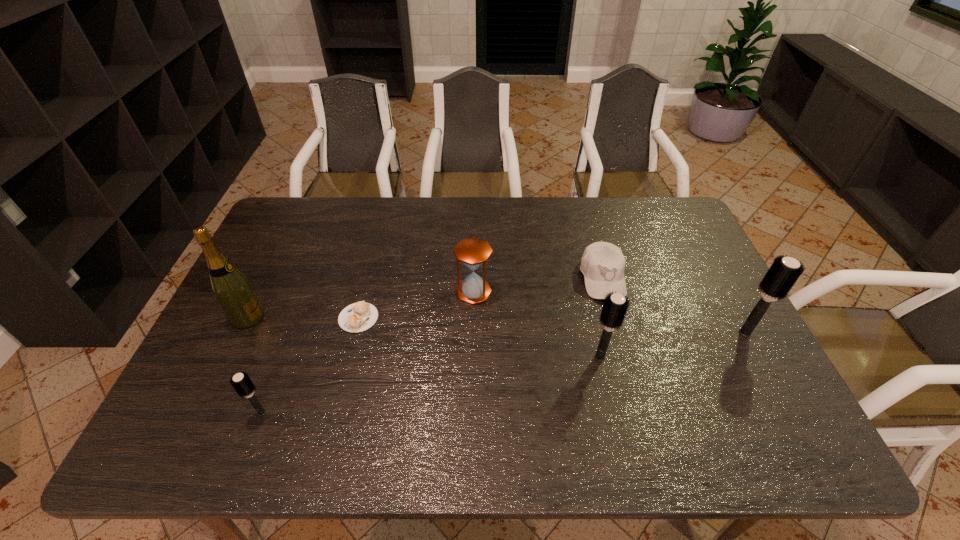
This screenshot has width=960, height=540. Identify the location of free area in between the second object from left to right and the baseball cap. (432, 346).

Locate an element on the screen. The width and height of the screenshot is (960, 540). free spot between the rightmost object and the baseball cap is located at coordinates (674, 306).

This screenshot has height=540, width=960. Find the location of `free space between the leftmost object and the sixth farthest object`. free space between the leftmost object and the sixth farthest object is located at coordinates (423, 337).

You are a GUI agent. You are given a task and a screenshot of the screen. Output one action in this format:
    pyautogui.click(x=<x>, y=<y>)
    Task: Click on the empty location between the hourglass and the cappuccino
    The image size is (960, 540).
    Given the screenshot: What is the action you would take?
    pyautogui.click(x=416, y=305)

Identify the location of vacant area that lies between the nearest object and the baseball cap. (432, 346).

Find the location of a particular element. Image resolution: width=960 pixels, height=540 pixels. unoccupied position between the leftmost hairbrush and the baseball cap is located at coordinates (432, 346).

Identify the location of free point between the second hairbrush from right to left and the nearest hairbrush. (430, 384).

Where is `object that is the third closest to the cappuccino`? This screenshot has height=540, width=960. object that is the third closest to the cappuccino is located at coordinates (241, 382).

Find the location of a particular element. This screenshot has height=540, width=960. the third closest object to the nearest object is located at coordinates (473, 252).

Identify which hairbrush is the closest to the second shortest object. Please provide its 2D coordinates. Your answer should be formatted as a tuple, i.e. [(x, y)], where the tuple contains the x and y coordinates of a point satisfying the conditions above.

[(615, 306)]